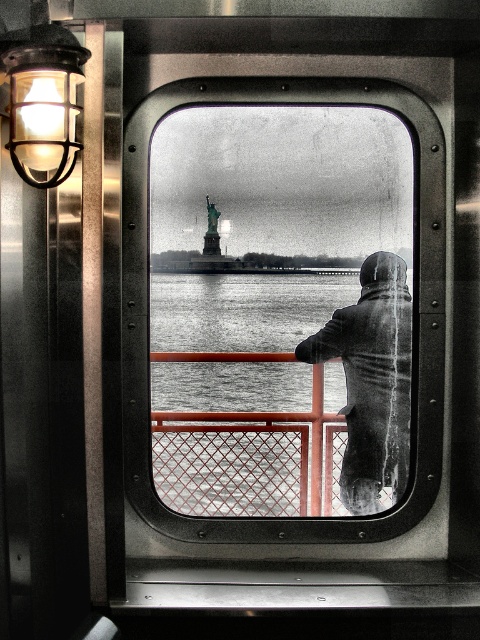
Between metallic glass window at center and matte black light fixture at upper left, which one is positioned lower?

metallic glass window at center is below.

Does metallic glass window at center appear on the left side of matte black light fixture at upper left?

No, metallic glass window at center is not to the left of matte black light fixture at upper left.

At what (x,y) coordinates should I click in order to perform the action: click on metallic glass window at center. Please return your answer as a coordinate pair (x, y). Looking at the image, I should click on (420, 264).

Locate an element on the screen. metallic glass window at center is located at coordinates (420, 264).

Between gray woolen coat at center and matte black light fixture at upper left, which one appears on the right side from the viewer's perspective?

Positioned to the right is gray woolen coat at center.

Can you confirm if gray woolen coat at center is positioned below matte black light fixture at upper left?

Indeed, gray woolen coat at center is positioned under matte black light fixture at upper left.

Measure the distance between point [355,444] and camera.

12.17 feet

The height and width of the screenshot is (640, 480). Find the location of `gray woolen coat at center`. gray woolen coat at center is located at coordinates (372, 381).

Between metallic glass window at center and gray woolen coat at center, which one has less height?

Standing shorter between the two is gray woolen coat at center.

Can you confirm if metallic glass window at center is wider than gray woolen coat at center?

Correct, the width of metallic glass window at center exceeds that of gray woolen coat at center.

The image size is (480, 640). What do you see at coordinates (420, 264) in the screenshot?
I see `metallic glass window at center` at bounding box center [420, 264].

At what (x,y) coordinates should I click in order to perform the action: click on metallic glass window at center. Please return your answer as a coordinate pair (x, y). The width and height of the screenshot is (480, 640). Looking at the image, I should click on click(x=420, y=264).